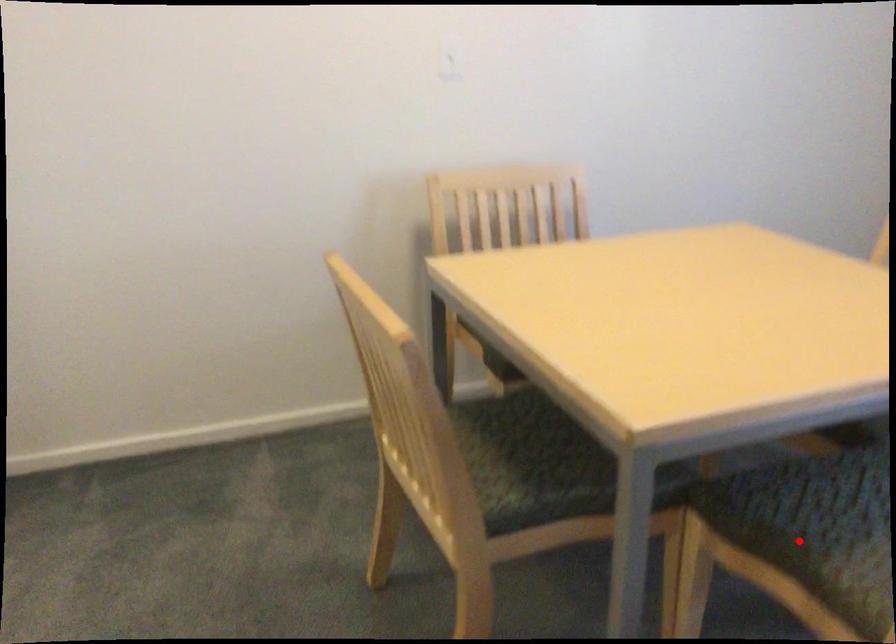
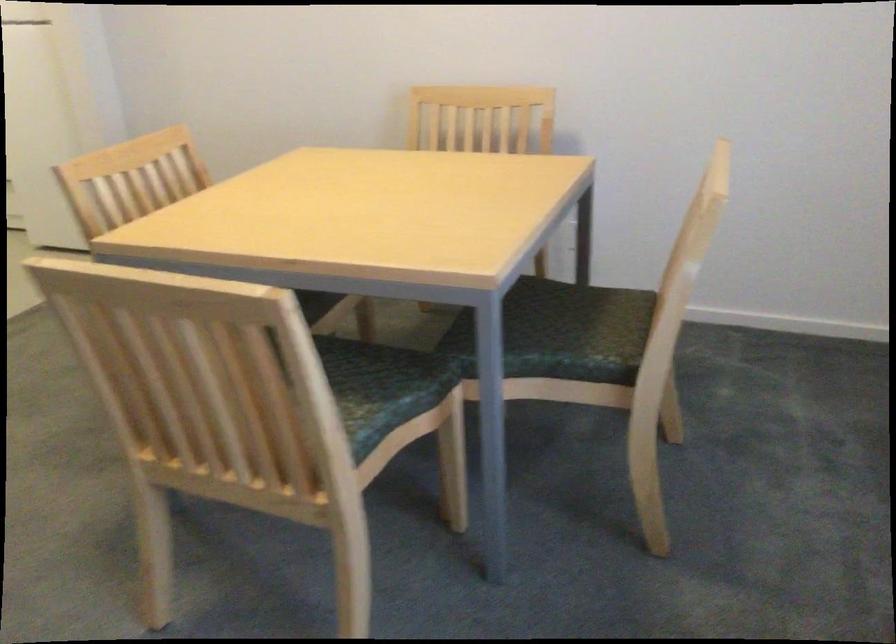
Question: I am providing you with two images of the same scene from different viewpoints. A red point is marked on the first image. Can you still see the location of the red point in image 2?

Choices:
 (A) Yes
 (B) No

Answer: (B)